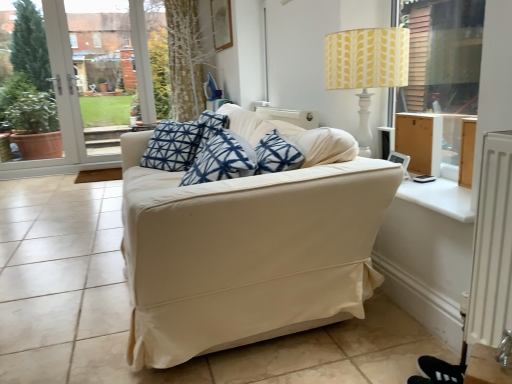
You are a GUI agent. You are given a task and a screenshot of the screen. Output one action in this format:
    pyautogui.click(x=<x>, y=<y>)
    Task: Click on the vacant space to the left of beige fabric couch at center
    The height and width of the screenshot is (384, 512).
    Given the screenshot: What is the action you would take?
    pos(57,245)